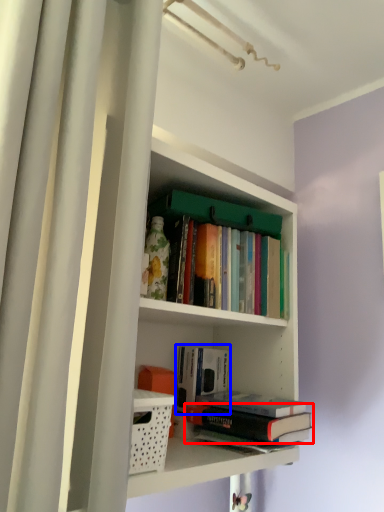
Question: Which of the following is the closest to the observer, book (highlighted by a red box) or book (highlighted by a blue box)?

Choices:
 (A) book
 (B) book

Answer: (A)